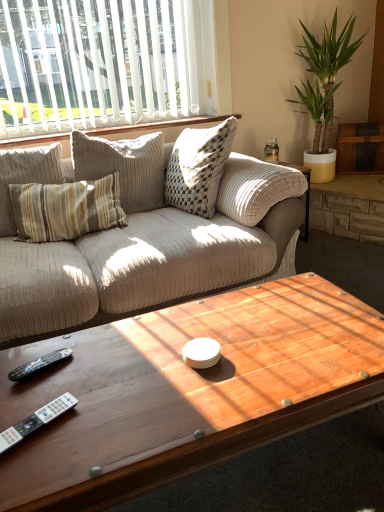
Question: Is green leafy plant at upper right facing away from black plastic remote at lower left?

Choices:
 (A) no
 (B) yes

Answer: (A)

Question: Can you confirm if green leafy plant at upper right is bigger than black plastic remote at lower left?

Choices:
 (A) yes
 (B) no

Answer: (A)

Question: From the image's perspective, is green leafy plant at upper right located beneath black plastic remote at lower left?

Choices:
 (A) yes
 (B) no

Answer: (B)

Question: Can you confirm if green leafy plant at upper right is thinner than black plastic remote at lower left?

Choices:
 (A) no
 (B) yes

Answer: (A)

Question: Is green leafy plant at upper right next to black plastic remote at lower left?

Choices:
 (A) no
 (B) yes

Answer: (A)

Question: Is point (67, 6) closer or farther from the camera than point (26, 429)?

Choices:
 (A) farther
 (B) closer

Answer: (A)

Question: From the image's perspective, relative to white plastic remote at lower left, is white vertical blinds at upper left above or below?

Choices:
 (A) above
 (B) below

Answer: (A)

Question: Considering the positions of white vertical blinds at upper left and white plastic remote at lower left in the image, is white vertical blinds at upper left bigger or smaller than white plastic remote at lower left?

Choices:
 (A) small
 (B) big

Answer: (B)

Question: Is white vertical blinds at upper left taller or shorter than white plastic remote at lower left?

Choices:
 (A) short
 (B) tall

Answer: (B)

Question: Visually, is black plastic remote at lower left positioned to the left or to the right of white textured pillows at upper center?

Choices:
 (A) right
 (B) left

Answer: (B)

Question: From a real-world perspective, relative to white textured pillows at upper center, is black plastic remote at lower left vertically above or below?

Choices:
 (A) below
 (B) above

Answer: (A)

Question: Looking at the image, does black plastic remote at lower left seem bigger or smaller compared to white textured pillows at upper center?

Choices:
 (A) big
 (B) small

Answer: (B)

Question: In terms of width, does black plastic remote at lower left look wider or thinner when compared to white textured pillows at upper center?

Choices:
 (A) thin
 (B) wide

Answer: (A)

Question: Is white plastic remote at lower left in front of or behind green leafy plant at upper right in the image?

Choices:
 (A) front
 (B) behind

Answer: (A)

Question: From their relative heights in the image, would you say white plastic remote at lower left is taller or shorter than green leafy plant at upper right?

Choices:
 (A) tall
 (B) short

Answer: (B)